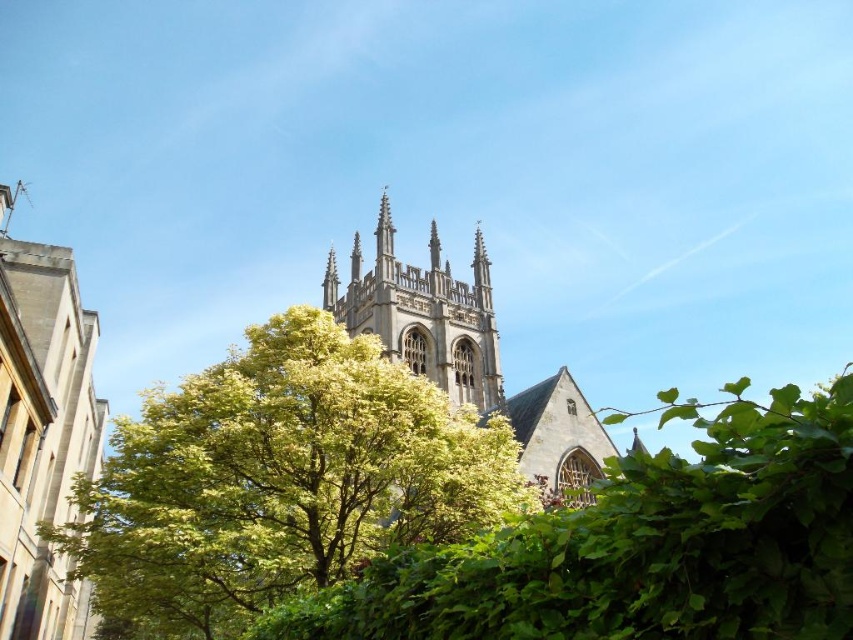
Question: Is green leafy tree at center bigger than smooth stone church at left?

Choices:
 (A) yes
 (B) no

Answer: (B)

Question: Which point is farther from the camera taking this photo?

Choices:
 (A) (56, 289)
 (B) (328, 266)
 (C) (698, 588)
 (D) (534, 438)

Answer: (B)

Question: Is green leafy tree at center further to camera compared to green leafy hedge at center?

Choices:
 (A) yes
 (B) no

Answer: (A)

Question: Among these points, which one is farthest from the camera?

Choices:
 (A) (332, 284)
 (B) (437, 378)

Answer: (A)

Question: Which point is closer to the camera?

Choices:
 (A) (325, 275)
 (B) (683, 580)

Answer: (B)

Question: Can you confirm if stone gothic church at center is thinner than stone gothic tower at center?

Choices:
 (A) yes
 (B) no

Answer: (B)